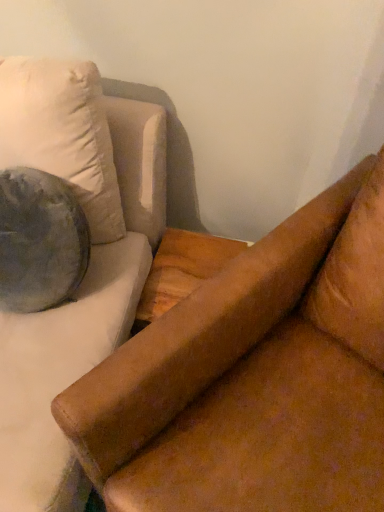
The height and width of the screenshot is (512, 384). What do you see at coordinates (251, 374) in the screenshot? I see `brown leather couch at upper right` at bounding box center [251, 374].

Locate an element on the screen. brown leather couch at upper right is located at coordinates (251, 374).

Locate an element on the screen. The height and width of the screenshot is (512, 384). brown leather couch at upper right is located at coordinates (251, 374).